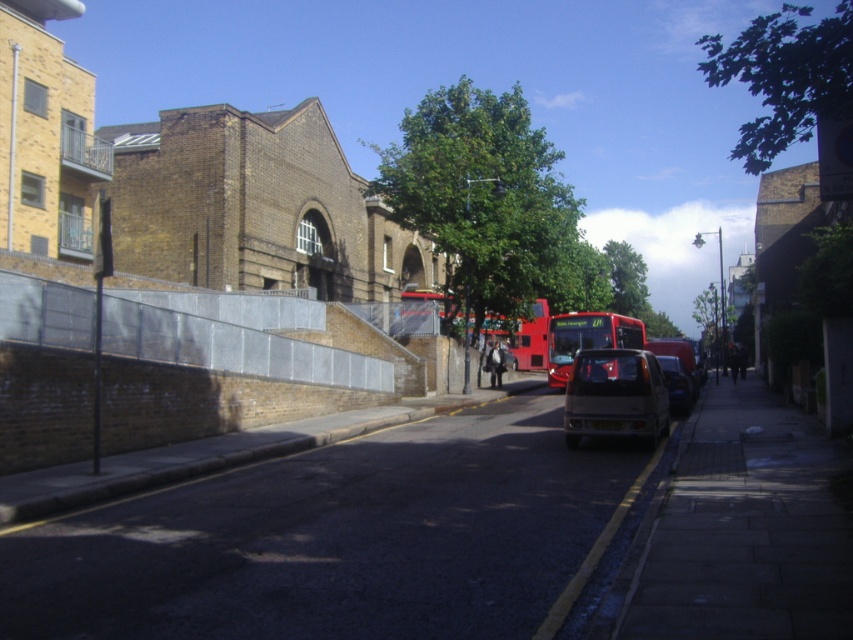
You are standing at the entrance of the building on the left side of the street. You want to walk to the matte silver hatchback at center. Which direction should you head towards?

Since the matte silver hatchback at center is located at point (614,396), you should head towards the center of the street to reach it.

You are a pedestrian standing on the sidewalk and want to cross the street to reach the modern apartment building on the left. There are two parked vehicles in the center of the image, a matte silver hatchback at center and a matte silver van at center. Which vehicle should you walk around to get to the apartment building first?

The matte silver hatchback at center is to the left of the matte silver van at center, so you should walk around the matte silver hatchback at center first to reach the modern apartment building on the left side.

You are standing on the street looking at the scene. There are two points marked on the image, point 1 at coordinates point [613,404] and point 2 at coordinates point [664,360]. Which point is closer to you?

Point [613,404] is closer to the viewer than point [664,360].